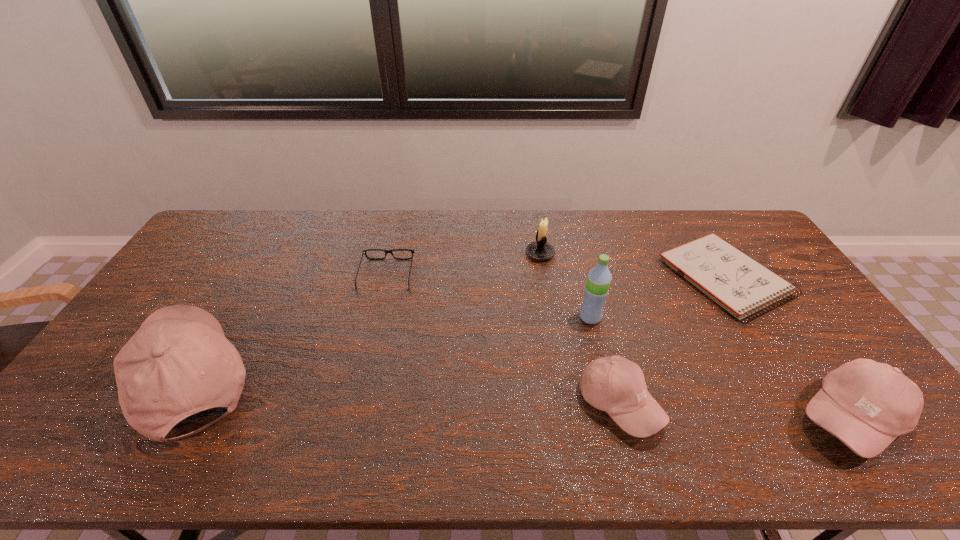
In the image, there is a desktop. Identify the location of blank space at the right edge. (764, 256).

Locate an element on the screen. This screenshot has height=540, width=960. free region at the near left corner is located at coordinates (109, 391).

Identify the location of vacant space at the far right corner. The height and width of the screenshot is (540, 960). (762, 246).

This screenshot has width=960, height=540. I want to click on empty location between the leftmost baseball cap and the notepad, so click(x=457, y=328).

Find the location of a particular element. Image resolution: width=960 pixels, height=540 pixels. vacant area between the notepad and the rightmost baseball cap is located at coordinates (787, 348).

Where is `free space between the rightmost baseball cap and the shortest object`? This screenshot has height=540, width=960. free space between the rightmost baseball cap and the shortest object is located at coordinates (787, 348).

This screenshot has height=540, width=960. Find the location of `free space between the sixth object from right to left and the leftmost baseball cap`. free space between the sixth object from right to left and the leftmost baseball cap is located at coordinates (289, 326).

This screenshot has height=540, width=960. Find the location of `free area in between the shortest object and the second object from left to right`. free area in between the shortest object and the second object from left to right is located at coordinates (555, 276).

Where is `free spot between the second baseball cap from left to right and the second object from left to right`? This screenshot has height=540, width=960. free spot between the second baseball cap from left to right and the second object from left to right is located at coordinates (503, 339).

Find the location of a particular element. This screenshot has width=960, height=540. unoccupied position between the leftmost baseball cap and the water bottle is located at coordinates (391, 348).